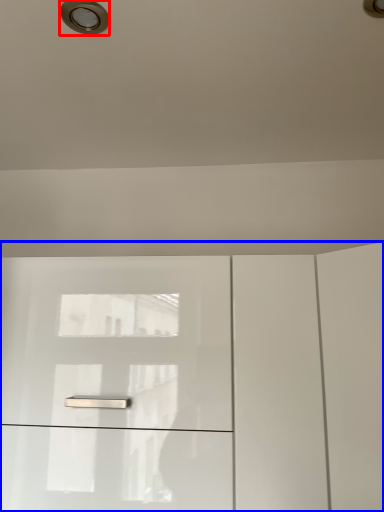
Question: Which point is closer to the camera, droplight (highlighted by a red box) or dresser (highlighted by a blue box)?

Choices:
 (A) droplight
 (B) dresser

Answer: (A)